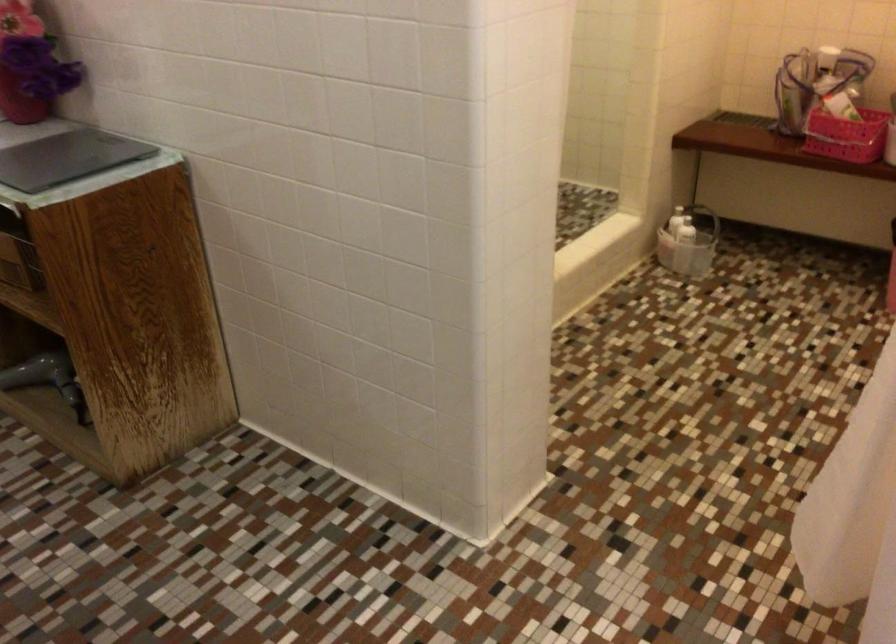
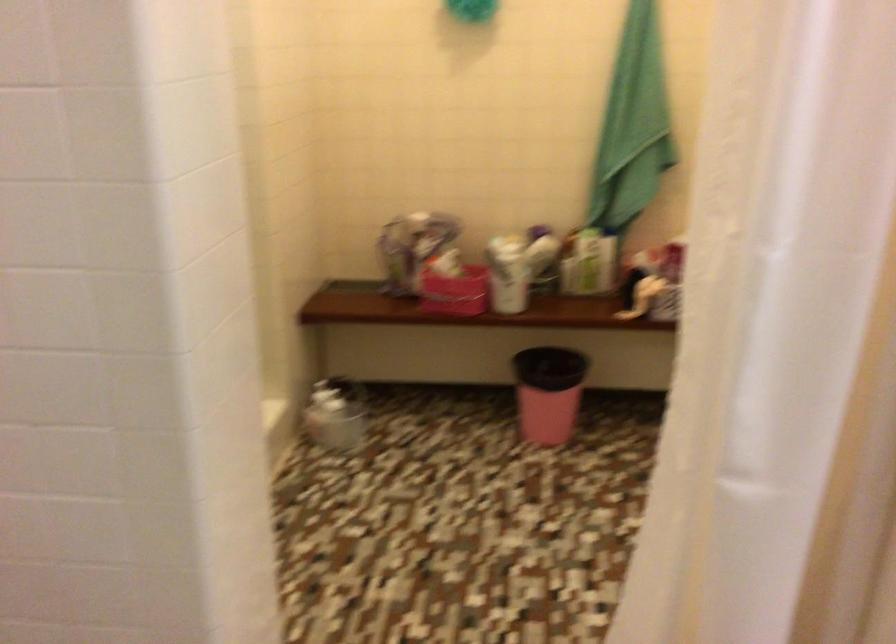
Question: The camera is either moving clockwise (left) or counter-clockwise (right) around the object. The first image is from the beginning of the video and the second image is from the end. Is the camera moving left or right when shooting the video?

Choices:
 (A) Left
 (B) Right

Answer: (A)